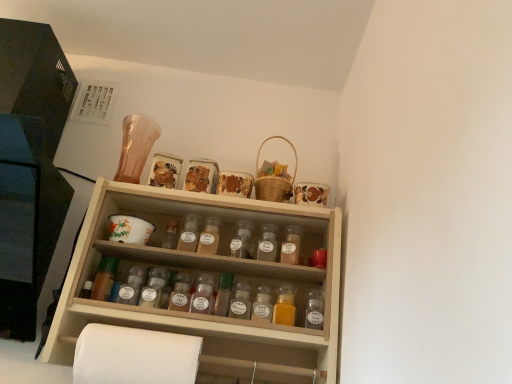
Question: Is translucent plastic spice jar at center, placed as the fourth bottle when sorted from right to left, directly adjacent to translucent plastic bottle at center, acting as the 2th bottle starting from the right?

Choices:
 (A) no
 (B) yes

Answer: (A)

Question: From a real-world perspective, is translucent plastic spice jar at center, which is the 4th bottle from left to right, located higher than translucent plastic bottle at center, which is the sixth bottle in left-to-right order?

Choices:
 (A) no
 (B) yes

Answer: (B)

Question: Is translucent plastic bottle at center, which is the sixth bottle in left-to-right order, inside translucent plastic spice jar at center, which is the 4th bottle from left to right?

Choices:
 (A) no
 (B) yes

Answer: (A)

Question: Considering the relative positions of translucent plastic spice jar at center, placed as the fourth bottle when sorted from right to left, and translucent plastic bottle at center, acting as the 2th bottle starting from the right, in the image provided, is translucent plastic spice jar at center, placed as the fourth bottle when sorted from right to left, to the right of translucent plastic bottle at center, acting as the 2th bottle starting from the right, from the viewer's perspective?

Choices:
 (A) no
 (B) yes

Answer: (A)

Question: Is translucent plastic spice jar at center, placed as the fourth bottle when sorted from right to left, facing towards translucent plastic bottle at center, acting as the 2th bottle starting from the right?

Choices:
 (A) yes
 (B) no

Answer: (B)

Question: Looking at their shapes, would you say wooden spice rack at left is wider or thinner than translucent glass spice jar at center, the third bottle in the right-to-left sequence?

Choices:
 (A) thin
 (B) wide

Answer: (B)

Question: From the image's perspective, is wooden spice rack at left located above or below translucent glass spice jar at center, the third bottle in the right-to-left sequence?

Choices:
 (A) above
 (B) below

Answer: (A)

Question: Would you say wooden spice rack at left is inside or outside translucent glass spice jar at center, the third bottle in the right-to-left sequence?

Choices:
 (A) inside
 (B) outside

Answer: (B)

Question: From a real-world perspective, is wooden spice rack at left positioned above or below translucent glass spice jar at center, the fifth bottle positioned from the left?

Choices:
 (A) below
 (B) above

Answer: (B)

Question: From the image's perspective, is translucent glass spice jar at center, which appears as the third bottle when viewed from the left, positioned above or below wooden spice rack at left?

Choices:
 (A) above
 (B) below

Answer: (B)

Question: Choose the correct answer: Is translucent glass spice jar at center, positioned as the 5th bottle in right-to-left order, inside wooden spice rack at left or outside it?

Choices:
 (A) inside
 (B) outside

Answer: (B)

Question: Considering the positions of translucent glass spice jar at center, which appears as the third bottle when viewed from the left, and wooden spice rack at left in the image, is translucent glass spice jar at center, which appears as the third bottle when viewed from the left, bigger or smaller than wooden spice rack at left?

Choices:
 (A) small
 (B) big

Answer: (A)

Question: Is point (214, 221) positioned closer to the camera than point (3, 266)?

Choices:
 (A) farther
 (B) closer

Answer: (A)

Question: In the image, is white paper at lower left positioned in front of or behind woven brown basket at upper right?

Choices:
 (A) front
 (B) behind

Answer: (A)

Question: Considering the relative positions of white paper at lower left and woven brown basket at upper right in the image provided, is white paper at lower left to the left or to the right of woven brown basket at upper right?

Choices:
 (A) right
 (B) left

Answer: (B)